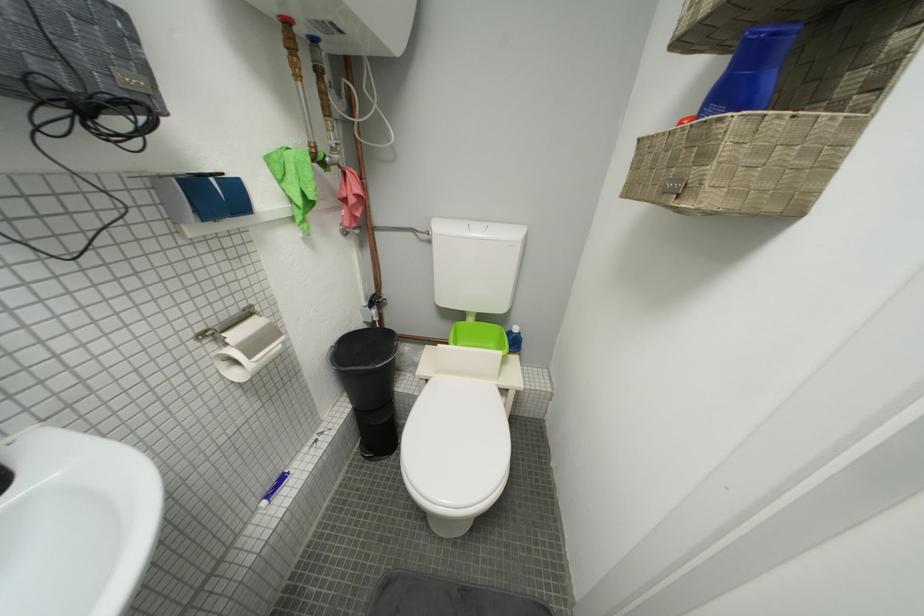
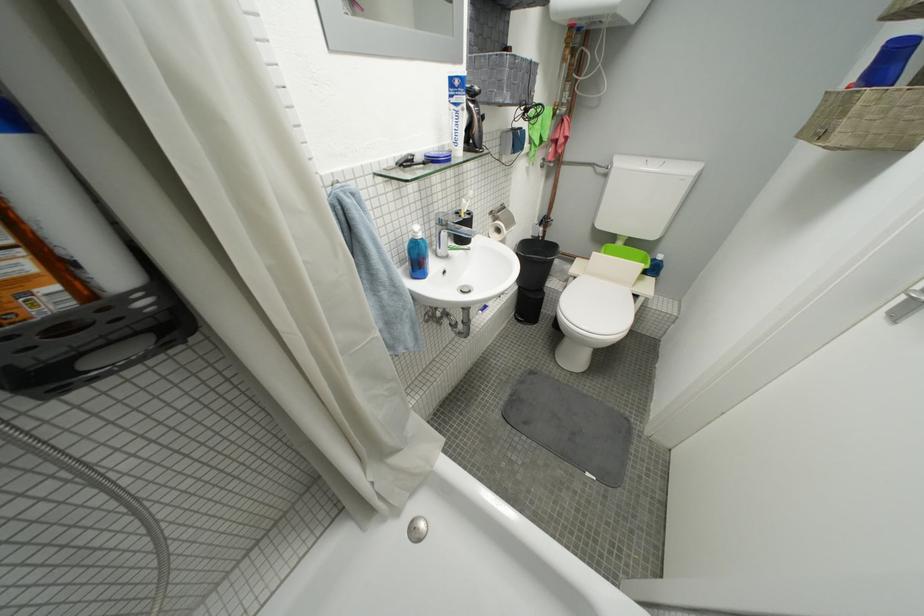
Find the pixel in the second image that matches point 487,233 in the first image.

(662, 169)